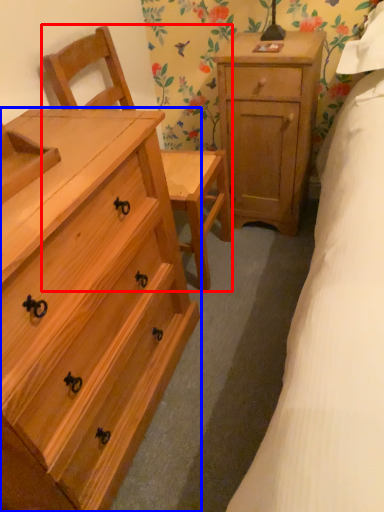
Question: Which of the following is the farthest to the observer, armchair (highlighted by a red box) or chest of drawers (highlighted by a blue box)?

Choices:
 (A) armchair
 (B) chest of drawers

Answer: (A)